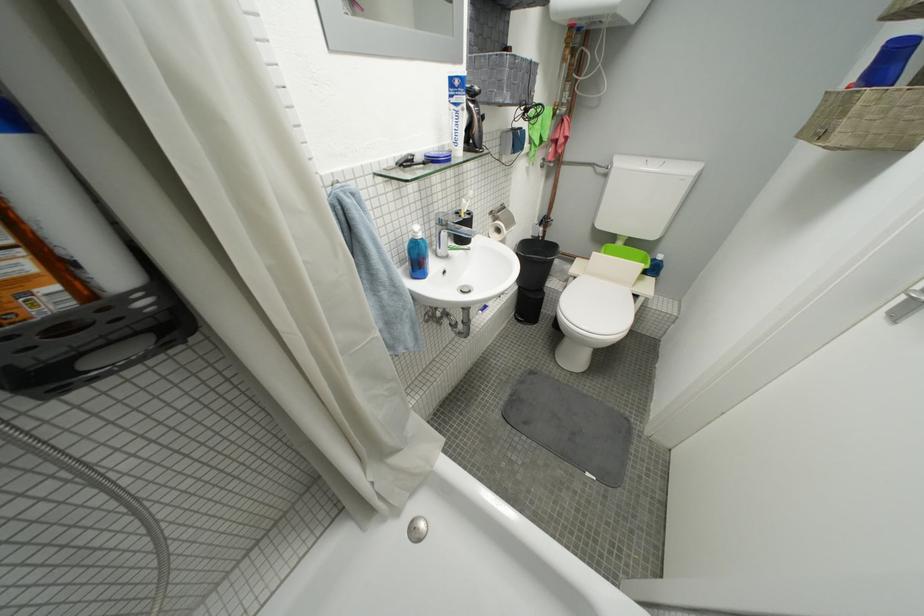
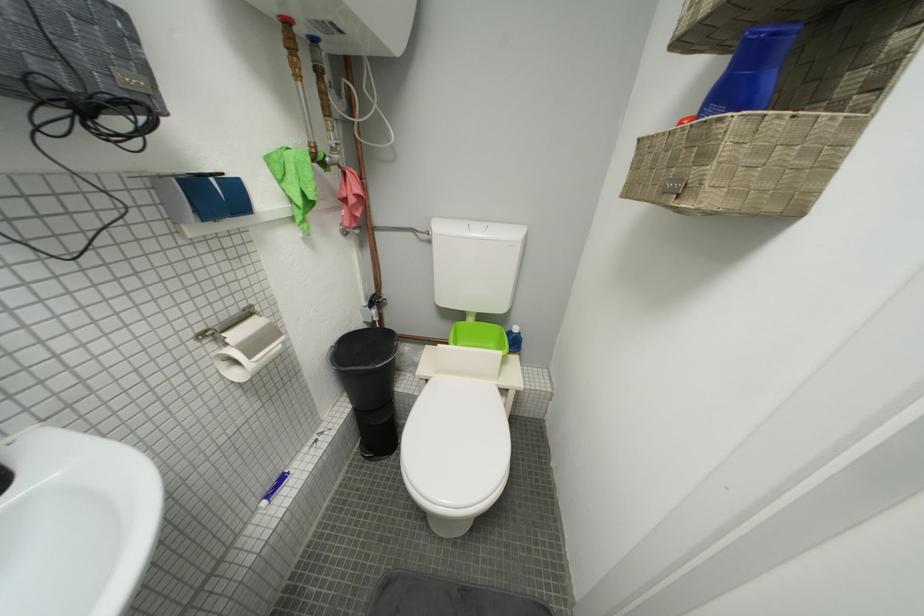
Question: The images are taken continuously from a first-person perspective. In which direction is your viewpoint rotating?

Choices:
 (A) Left
 (B) Right
 (C) Up
 (D) Down

Answer: (B)